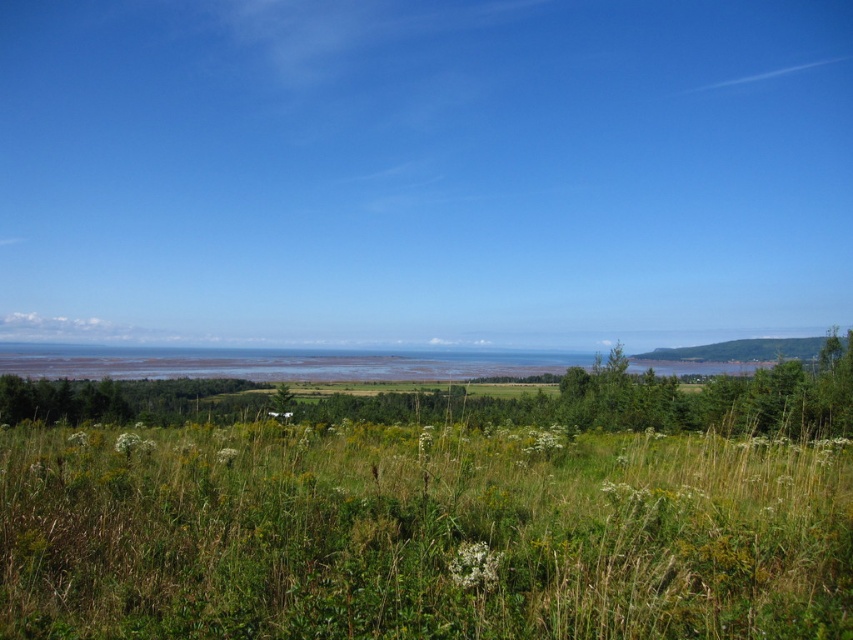
You are standing at the origin point in the image. Where is the green grassy field at center located in terms of coordinates?

The green grassy field at center is located at coordinates point (419, 536).

You are standing in a field and want to cross to the other side. The green grassy field at center is in front of you. Can you safely walk across it if you are 1.7 meters tall?

The green grassy field at center is 4.18 meters away from you, so yes, you can safely walk across it since the distance is manageable for a person of 1.7 meters in height.